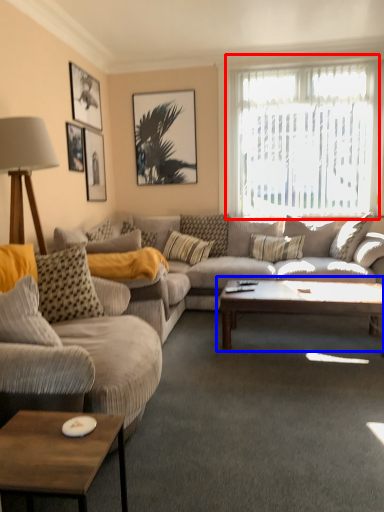
Question: Among these objects, which one is farthest to the camera, window (highlighted by a red box) or coffee table (highlighted by a blue box)?

Choices:
 (A) window
 (B) coffee table

Answer: (A)